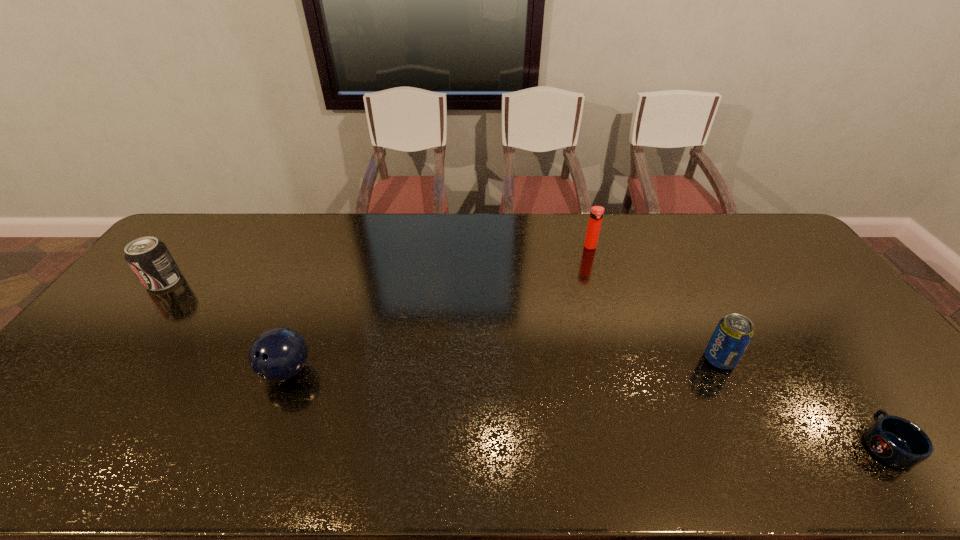
You are a GUI agent. You are given a task and a screenshot of the screen. Output one action in this format:
    pyautogui.click(x=<x>, y=<y>)
    Task: Click on the object positioned at the near right corner
    The image size is (960, 540).
    Given the screenshot: What is the action you would take?
    pyautogui.click(x=898, y=442)

Identify the location of free space at the far edge. The width and height of the screenshot is (960, 540). (567, 248).

In the image, there is a desktop. Where is `vacant region at the near edge`? This screenshot has width=960, height=540. vacant region at the near edge is located at coordinates (713, 454).

Locate an element on the screen. The image size is (960, 540). free spot at the left edge of the desktop is located at coordinates (96, 380).

This screenshot has height=540, width=960. What are the coordinates of `free spot at the right edge of the desktop` in the screenshot? It's located at (777, 282).

You are a GUI agent. You are given a task and a screenshot of the screen. Output one action in this format:
    pyautogui.click(x=<x>, y=<y>)
    Task: Click on the vacant space at the near left corner of the desktop
    The height and width of the screenshot is (540, 960).
    Given the screenshot: What is the action you would take?
    pyautogui.click(x=34, y=472)

Image resolution: width=960 pixels, height=540 pixels. I want to click on vacant space at the near right corner, so click(937, 457).

At what (x,y) coordinates should I click in order to perform the action: click on empty space between the left soda and the bowling ball. Please return your answer as a coordinate pair (x, y). Looking at the image, I should click on (226, 326).

This screenshot has width=960, height=540. I want to click on empty location between the farthest object and the nearer soda, so click(x=655, y=303).

At what (x,y) coordinates should I click in order to perform the action: click on vacant area that lies between the mug and the left soda. Please return your answer as a coordinate pair (x, y). The image size is (960, 540). Looking at the image, I should click on (525, 362).